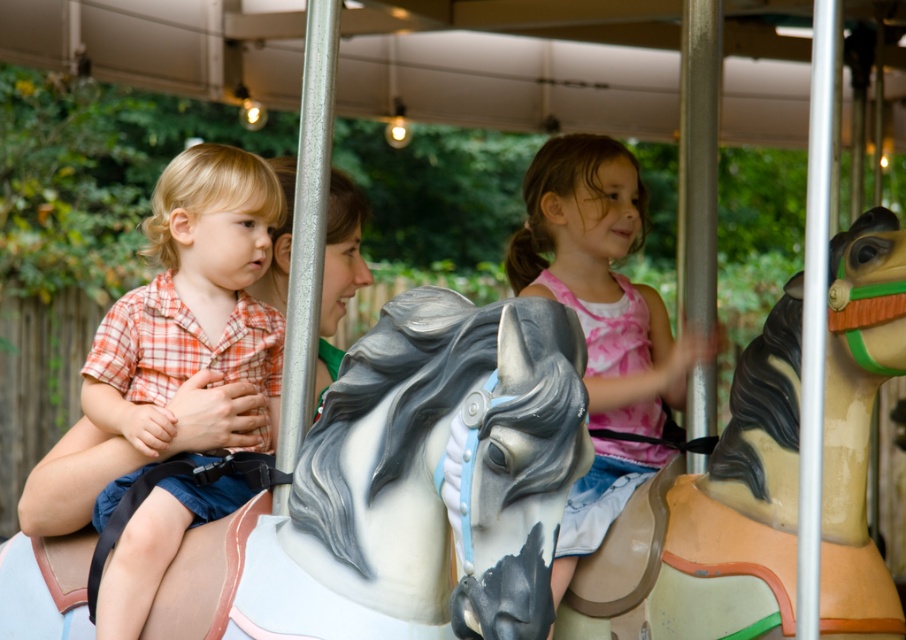
You are a photographer trying to capture a photo of the carousel. You see the white glossy horse at left and the matte brown horse at center. Which horse should you focus on if you want to include both in your shot while keeping them aligned horizontally?

You should focus on the matte brown horse at center because the white glossy horse at left is positioned on the left side of it, so centering the matte brown horse at center will keep both horses aligned horizontally in the frame.

You are standing at the center of the carousel and want to move towards the point labeled point (519, 634). Is this point closer to you than the point labeled point (699, 340)?

Yes, the point labeled point (519, 634) is closer to you because it is in front of the point labeled point (699, 340) according to their spatial arrangement.